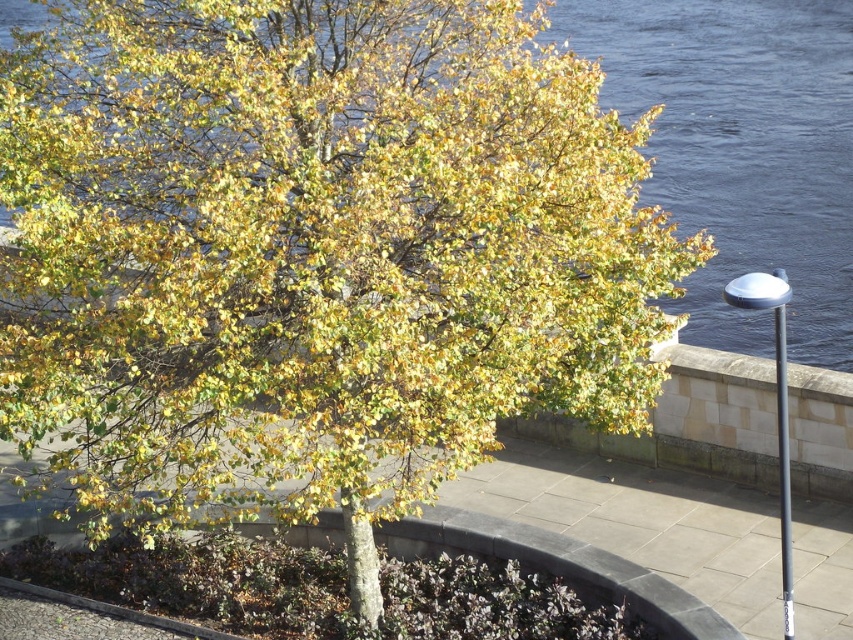
You are a gardener planning to place a decorative stone sculpture that is 2 meters wide on the gray concrete pavement at center and the sleek metallic pole at right. Which location would allow the sculpture to fit without touching the pole?

The gray concrete pavement at center has a larger size compared to the sleek metallic pole at right, so placing the 2 meter wide sculpture on the gray concrete pavement at center would provide enough space to avoid touching the pole.

You are a delivery drone flying over the waterfront scene. You need to land on the gray concrete pavement at center, but you have to avoid hitting the sleek metallic pole at right. Based on the scene, can you safely land there without hitting the pole?

The gray concrete pavement at center is much taller than the sleek metallic pole at right, so the drone can safely land there without hitting the pole.